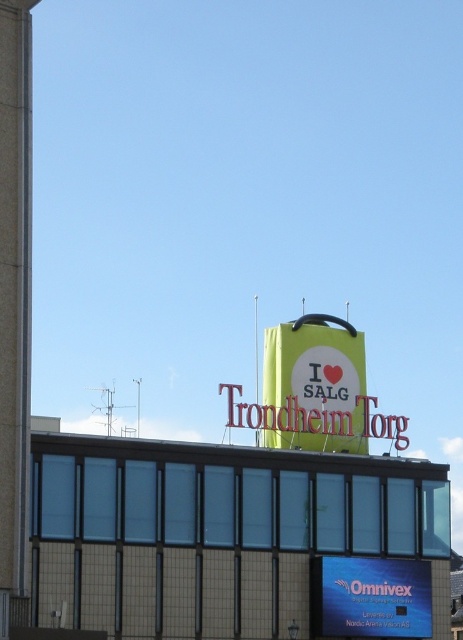
Who is more forward, (11, 96) or (342, 440)?

Point (11, 96)

Looking at this image, is smooth concrete pillar at left taller than matte yellow sign at center?

Yes.

Between point (24, 301) and point (269, 390), which one is positioned in front?

Point (24, 301)

At what (x,y) coordinates should I click in order to perform the action: click on smooth concrete pillar at left. Please return your answer as a coordinate pair (x, y). Looking at the image, I should click on (x=14, y=304).

Does smooth concrete pillar at left appear under blue glossy sign at upper center?

Actually, smooth concrete pillar at left is above blue glossy sign at upper center.

From the picture: Measure the distance between smooth concrete pillar at left and camera.

smooth concrete pillar at left is 56.65 meters away from camera.

Does point (0, 349) lie in front of point (385, 627)?

Yes, point (0, 349) is in front of point (385, 627).

You are a GUI agent. You are given a task and a screenshot of the screen. Output one action in this format:
    pyautogui.click(x=<x>, y=<y>)
    Task: Click on the smooth concrete pillar at left
    The image size is (463, 640).
    Given the screenshot: What is the action you would take?
    pyautogui.click(x=14, y=304)

Can you confirm if matte yellow sign at center is positioned to the left of blue glossy sign at upper center?

Indeed, matte yellow sign at center is positioned on the left side of blue glossy sign at upper center.

Can you confirm if matte yellow sign at center is positioned below blue glossy sign at upper center?

No.

Who is more forward, [321,372] or [344,579]?

Point [344,579] is more forward.

Identify the location of matte yellow sign at center. The height and width of the screenshot is (640, 463). (316, 380).